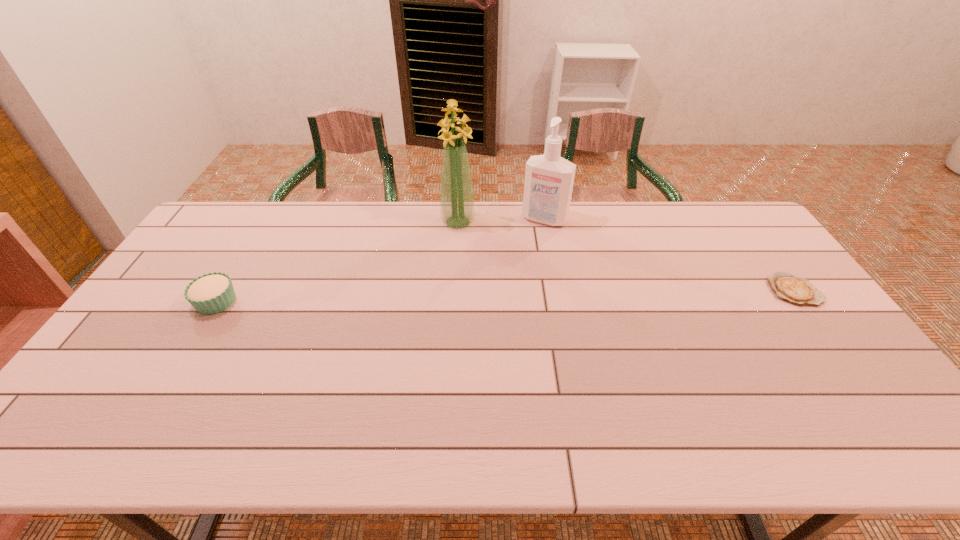
The height and width of the screenshot is (540, 960). In the image, there is a desktop. Identify the location of vacant area at the near edge. (540, 392).

Identify the location of free space at the left edge of the desktop. (201, 263).

In the image, there is a desktop. At what (x,y) coordinates should I click in order to perform the action: click on vacant space at the right edge. Please return your answer as a coordinate pair (x, y). This screenshot has width=960, height=540. Looking at the image, I should click on (751, 267).

Image resolution: width=960 pixels, height=540 pixels. In the image, there is a desktop. What are the coordinates of `vacant area at the far left corner` in the screenshot? It's located at (252, 220).

At what (x,y) coordinates should I click in order to perform the action: click on free space at the far right corner of the desktop. Please return your answer as a coordinate pair (x, y). Looking at the image, I should click on (738, 233).

At what (x,y) coordinates should I click in order to perform the action: click on free space between the second object from left to right and the third shortest object. Please return your answer as a coordinate pair (x, y). The height and width of the screenshot is (540, 960). Looking at the image, I should click on (501, 220).

You are a GUI agent. You are given a task and a screenshot of the screen. Output one action in this format:
    pyautogui.click(x=<x>, y=<y>)
    Task: Click on the free space between the second object from right to left and the second shortest object
    This screenshot has height=540, width=960.
    Given the screenshot: What is the action you would take?
    pyautogui.click(x=380, y=260)

At what (x,y) coordinates should I click in order to perform the action: click on vacant point located between the cleansing agent and the shortest object. Please return your answer as a coordinate pair (x, y). Looking at the image, I should click on (669, 255).

The image size is (960, 540). Identify the location of unoccupied position between the cupcake and the bouquet. (337, 262).

In order to click on unoccupied area between the second object from left to right and the rightmost object in this screenshot , I will do `click(626, 256)`.